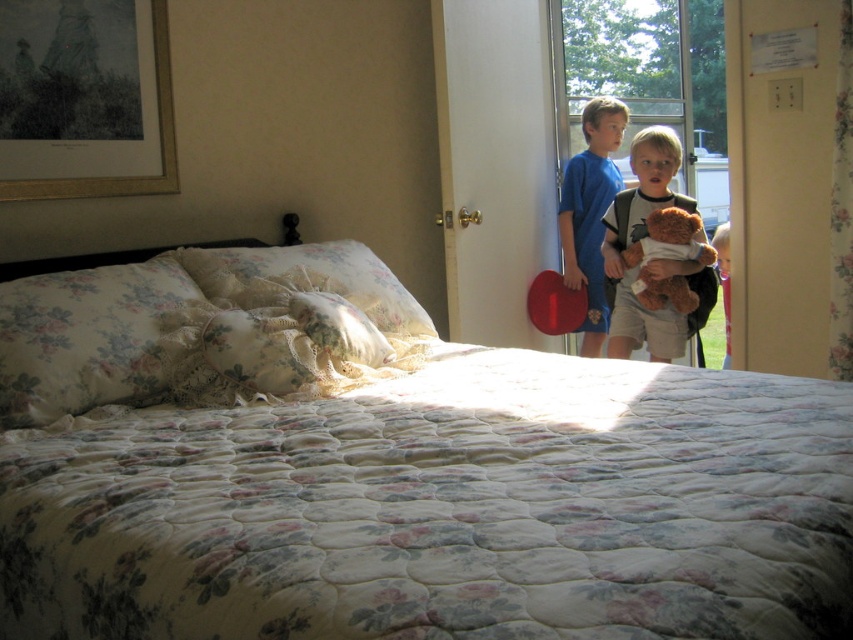
Can you confirm if floral fabric pillow at left is positioned below brown plush teddy bear at center?

Correct, floral fabric pillow at left is located below brown plush teddy bear at center.

Does floral fabric pillow at left have a greater height compared to brown plush teddy bear at center?

Yes, floral fabric pillow at left is taller than brown plush teddy bear at center.

Where is `floral fabric pillow at left`? This screenshot has width=853, height=640. floral fabric pillow at left is located at coordinates (83, 337).

Is the position of floral quilted bed at center more distant than that of blue cotton shirt at center?

That is False.

I want to click on floral quilted bed at center, so click(390, 470).

Is point (357, 548) positioned before point (566, 202)?

Yes, point (357, 548) is closer to viewer.

Where is `floral quilted bed at center`? floral quilted bed at center is located at coordinates (390, 470).

Can you confirm if floral quilted bed at center is taller than brown plush teddy bear at center?

Yes, floral quilted bed at center is taller than brown plush teddy bear at center.

Is floral quilted bed at center bigger than brown plush teddy bear at center?

Yes.

At what (x,y) coordinates should I click in order to perform the action: click on floral quilted bed at center. Please return your answer as a coordinate pair (x, y). The width and height of the screenshot is (853, 640). Looking at the image, I should click on (390, 470).

Locate an element on the screen. floral quilted bed at center is located at coordinates (390, 470).